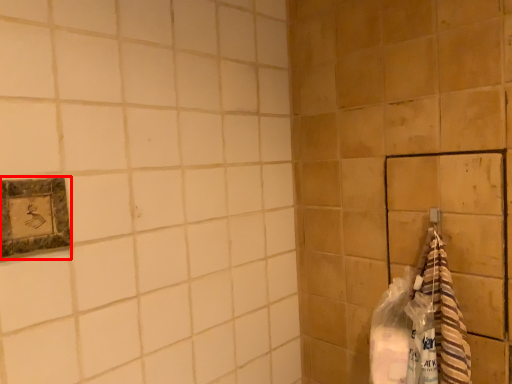
Question: From the image's perspective, what is the correct spatial relationship of picture frame (annotated by the red box) in relation to material?

Choices:
 (A) below
 (B) above

Answer: (B)